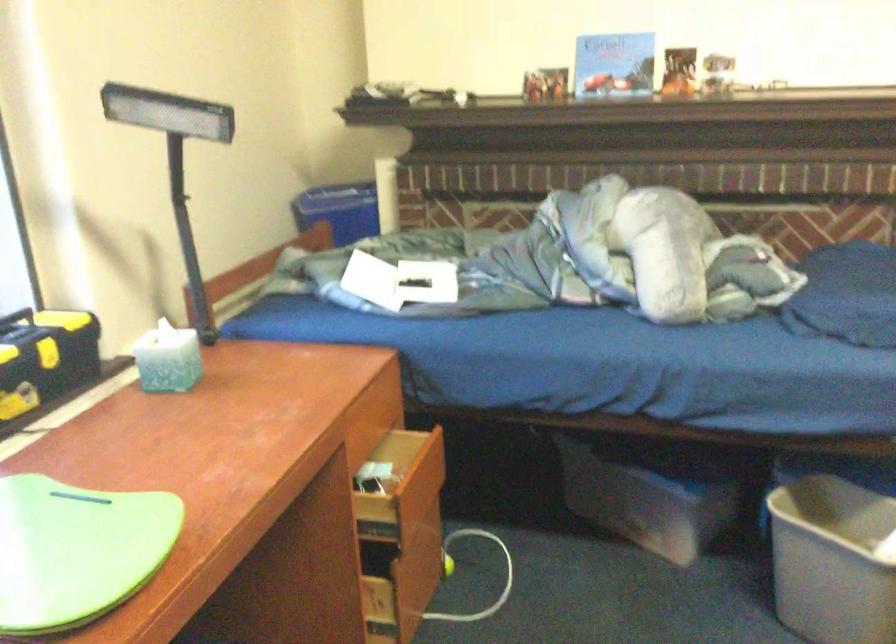
Locate an element on the screen. The height and width of the screenshot is (644, 896). blue tissue dispenser is located at coordinates (168, 359).